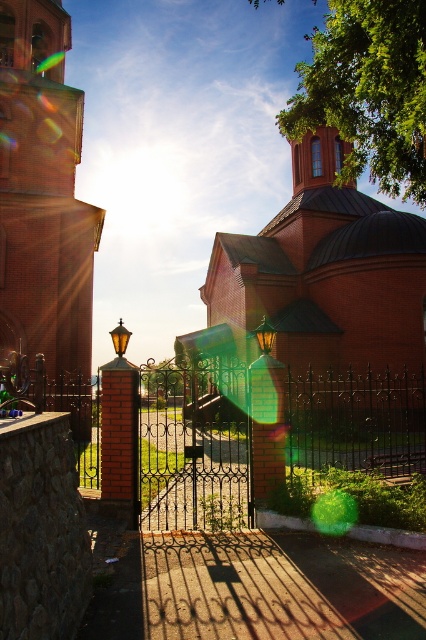
Is black wrought iron gate at center below brick tower at left?

Indeed, black wrought iron gate at center is positioned under brick tower at left.

Which is in front, point (314, 428) or point (80, 204)?

Positioned in front is point (314, 428).

Which is in front, point (405, 506) or point (69, 380)?

Positioned in front is point (405, 506).

Find the location of `black wrought iron gate at center`. black wrought iron gate at center is located at coordinates coord(356,444).

In the scene shown: Can you confirm if red brick church at center is positioned to the left of brick tower at left?

No, red brick church at center is not to the left of brick tower at left.

Describe the element at coordinates (325, 273) in the screenshot. Image resolution: width=426 pixels, height=640 pixels. I see `red brick church at center` at that location.

Image resolution: width=426 pixels, height=640 pixels. What do you see at coordinates (325, 273) in the screenshot? I see `red brick church at center` at bounding box center [325, 273].

Identify the location of red brick church at center. (325, 273).

Is black wrought iron gate at center smaller than red brick church at center?

No, black wrought iron gate at center is not smaller than red brick church at center.

Does black wrought iron gate at center lie in front of red brick church at center?

Yes, black wrought iron gate at center is closer to the viewer.

Image resolution: width=426 pixels, height=640 pixels. Identify the location of black wrought iron gate at center. (356, 444).